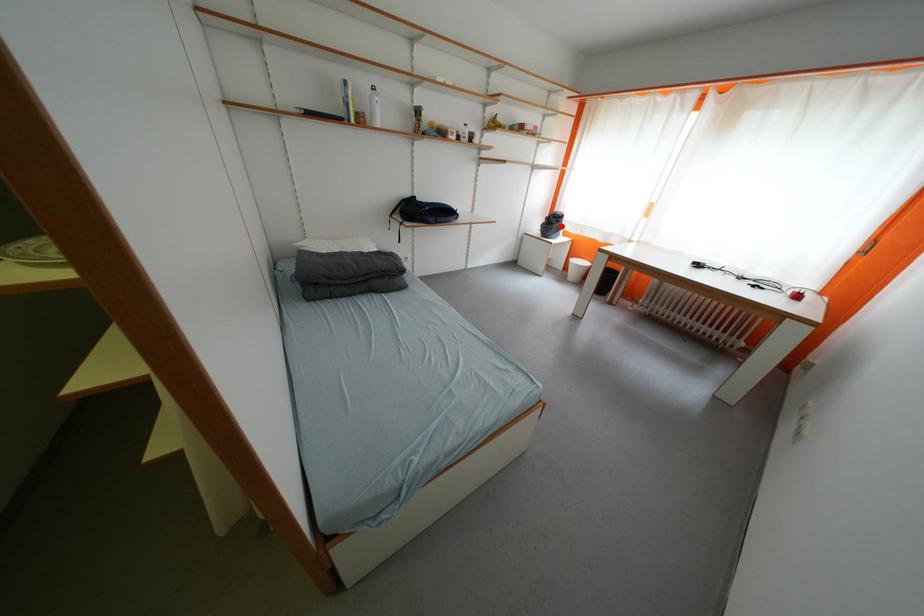
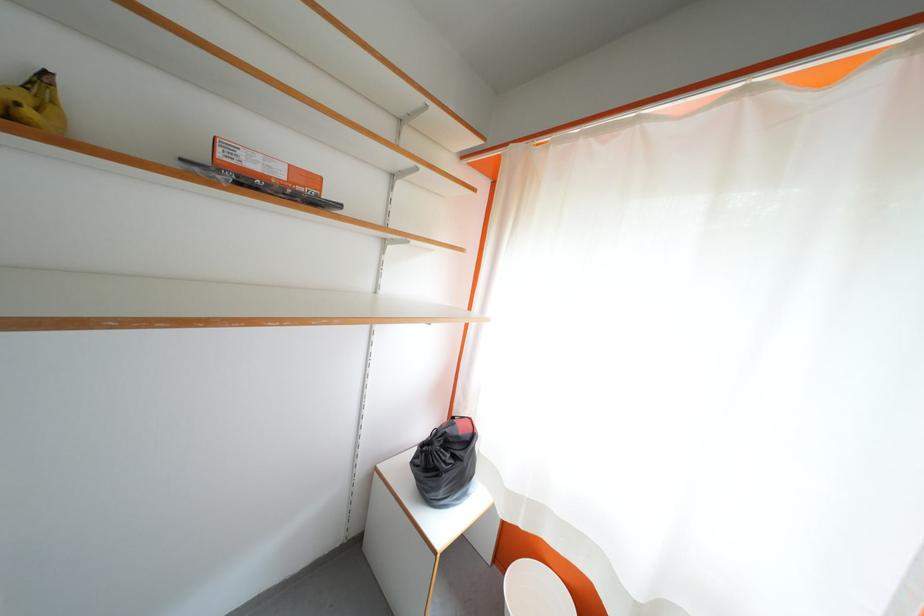
Find the pixel in the second image that matches the highlighted location in the first image.

(455, 460)